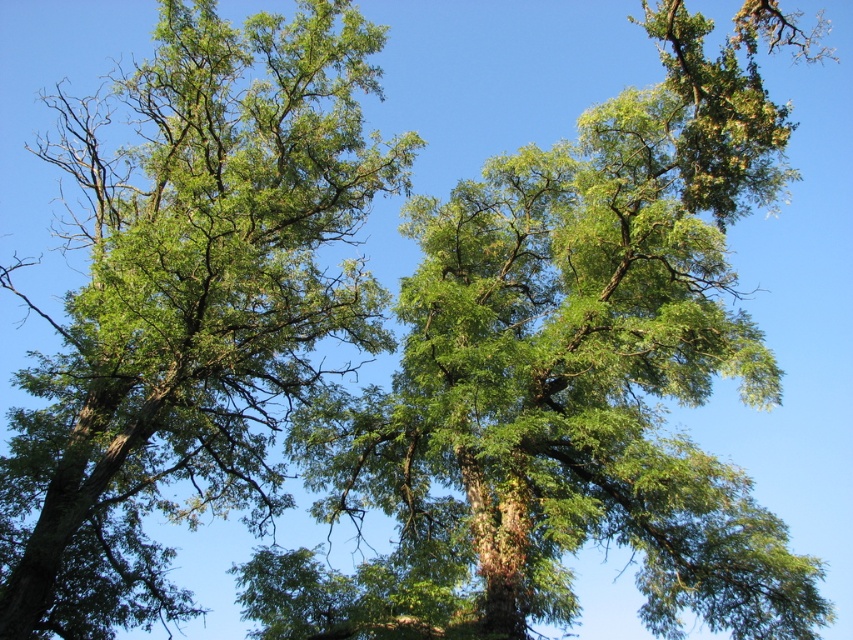
The image size is (853, 640). What do you see at coordinates (566, 378) in the screenshot? I see `green leafy oak tree at center` at bounding box center [566, 378].

Is green leafy oak tree at center positioned before green leafy tree at center?

Yes, it is.

You are a GUI agent. You are given a task and a screenshot of the screen. Output one action in this format:
    pyautogui.click(x=<x>, y=<y>)
    Task: Click on the green leafy oak tree at center
    The image size is (853, 640).
    Given the screenshot: What is the action you would take?
    pyautogui.click(x=566, y=378)